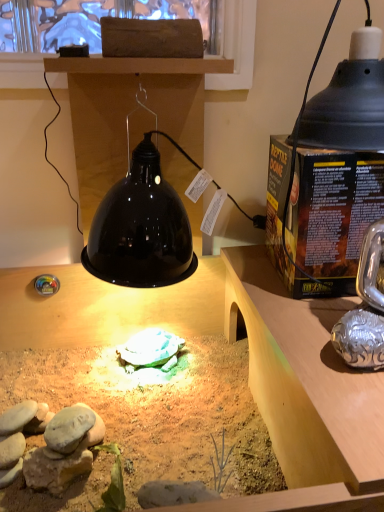
Locate an element on the screen. This screenshot has width=384, height=512. wooden desk at center is located at coordinates coord(102,308).

This screenshot has width=384, height=512. What do you see at coordinates (102, 308) in the screenshot?
I see `wooden desk at center` at bounding box center [102, 308].

Where is `black matte lampshade at upper right`? This screenshot has width=384, height=512. black matte lampshade at upper right is located at coordinates (344, 106).

Measure the distance between black matte lampshade at upper right and camera.

The depth of black matte lampshade at upper right is 23.71 inches.

The image size is (384, 512). Describe the element at coordinates (344, 106) in the screenshot. I see `black matte lampshade at upper right` at that location.

Identify the location of wooden desk at center. (102, 308).

Is black matte lampshade at upper right to the left of wooden desk at center from the viewer's perspective?

In fact, black matte lampshade at upper right is to the right of wooden desk at center.

Which object is closer to the camera taking this photo, black matte lampshade at upper right or wooden desk at center?

Positioned in front is wooden desk at center.

Which is closer to the camera, (x=369, y=28) or (x=146, y=292)?

Point (x=369, y=28) appears to be closer to the viewer than point (x=146, y=292).

From the image's perspective, which one is positioned higher, black matte lampshade at upper right or wooden desk at center?

black matte lampshade at upper right, from the image's perspective.

From a real-world perspective, which is physically above, black matte lampshade at upper right or wooden desk at center?

In real-world perspective, black matte lampshade at upper right is above.

Considering the sizes of objects black matte lampshade at upper right and wooden desk at center in the image provided, who is wider, black matte lampshade at upper right or wooden desk at center?

Wider between the two is wooden desk at center.

Considering the relative sizes of black matte lampshade at upper right and wooden desk at center in the image provided, is black matte lampshade at upper right taller than wooden desk at center?

In fact, black matte lampshade at upper right may be shorter than wooden desk at center.

In the scene shown: Considering the sizes of objects black matte lampshade at upper right and wooden desk at center in the image provided, who is smaller, black matte lampshade at upper right or wooden desk at center?

black matte lampshade at upper right is smaller.

Is black matte lampshade at upper right not within wooden desk at center?

black matte lampshade at upper right is positioned outside wooden desk at center.

Is black matte lampshade at upper right directly adjacent to wooden desk at center?

No.

Is black matte lampshade at upper right looking in the opposite direction of wooden desk at center?

No, black matte lampshade at upper right is not facing the opposite direction of wooden desk at center.

Can you tell me how much black matte lampshade at upper right and wooden desk at center differ in facing direction?

black matte lampshade at upper right and wooden desk at center are facing 3.63 degrees away from each other.

I want to click on lamp on the right of wooden desk at center, so [x=344, y=106].

Visually, is wooden desk at center positioned to the left or to the right of black matte lampshade at upper right?

Clearly, wooden desk at center is on the left of black matte lampshade at upper right in the image.

Does wooden desk at center come in front of black matte lampshade at upper right?

Yes, it is in front of black matte lampshade at upper right.

Which is behind, point (32, 277) or point (315, 139)?

The point (32, 277) is more distant.

From the image's perspective, which object appears higher, wooden desk at center or black matte lampshade at upper right?

black matte lampshade at upper right, from the image's perspective.

From a real-world perspective, relative to black matte lampshade at upper right, is wooden desk at center vertically above or below?

wooden desk at center is situated lower than black matte lampshade at upper right in the real world.

Looking at their sizes, would you say wooden desk at center is wider or thinner than black matte lampshade at upper right?

Considering their sizes, wooden desk at center looks broader than black matte lampshade at upper right.

In terms of height, does wooden desk at center look taller or shorter compared to black matte lampshade at upper right?

In the image, wooden desk at center appears to be taller than black matte lampshade at upper right.

Based on the photo, does wooden desk at center have a larger size compared to black matte lampshade at upper right?

Indeed, wooden desk at center has a larger size compared to black matte lampshade at upper right.

Do you think wooden desk at center is within black matte lampshade at upper right, or outside of it?

wooden desk at center is not inside black matte lampshade at upper right, it's outside.

Is wooden desk at center far away from black matte lampshade at upper right?

That's not correct — wooden desk at center is a little close to black matte lampshade at upper right.

Based on the photo, is wooden desk at center looking in the opposite direction of black matte lampshade at upper right?

wooden desk at center does not have its back to black matte lampshade at upper right.

Can you tell me how much wooden desk at center and black matte lampshade at upper right differ in facing direction?

They differ by 3.63 degrees in their facing directions.

Locate an element on the screen. This screenshot has width=384, height=512. desk lying below the black matte lampshade at upper right (from the image's perspective) is located at coordinates (102, 308).

Find the location of a particular element. lamp lying on the right of wooden desk at center is located at coordinates (344, 106).

Identify the location of lamp lying behind the wooden desk at center. (344, 106).